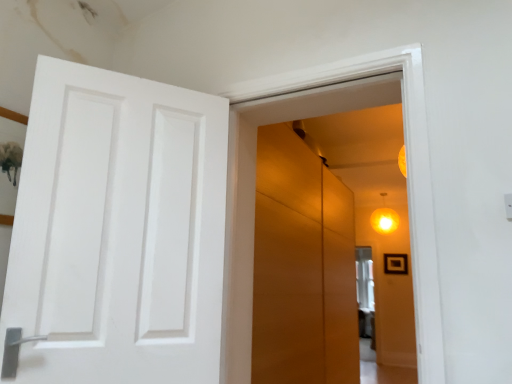
The image size is (512, 384). I want to click on black matte picture frame at upper right, so click(395, 264).

Locate an element on the screen. The image size is (512, 384). black matte picture frame at upper right is located at coordinates (395, 264).

From the image's perspective, between matte yellow globe light at upper right and black matte picture frame at upper right, which one is located above?

From the image's view, matte yellow globe light at upper right is above.

Does matte yellow globe light at upper right touch black matte picture frame at upper right?

No, matte yellow globe light at upper right is not next to black matte picture frame at upper right.

Is matte yellow globe light at upper right to the left of black matte picture frame at upper right from the viewer's perspective?

Yes.

Can you confirm if matte yellow globe light at upper right is taller than black matte picture frame at upper right?

Yes, matte yellow globe light at upper right is taller than black matte picture frame at upper right.

Does matte orange cabinet at center appear on the right side of matte yellow globe light at upper right?

In fact, matte orange cabinet at center is to the left of matte yellow globe light at upper right.

From the image's perspective, between matte orange cabinet at center and matte yellow globe light at upper right, which one is located above?

matte yellow globe light at upper right.

Is matte orange cabinet at center beside matte yellow globe light at upper right?

No.

Does matte orange cabinet at center have a greater width compared to matte yellow globe light at upper right?

In fact, matte orange cabinet at center might be narrower than matte yellow globe light at upper right.

Is matte orange cabinet at center next to black matte picture frame at upper right and touching it?

matte orange cabinet at center and black matte picture frame at upper right are clearly separated.

How many degrees apart are the facing directions of matte orange cabinet at center and black matte picture frame at upper right?

There is a 90-degree angle between the facing directions of matte orange cabinet at center and black matte picture frame at upper right.

Considering the relative positions of matte orange cabinet at center and black matte picture frame at upper right in the image provided, is matte orange cabinet at center in front of black matte picture frame at upper right?

Yes, matte orange cabinet at center is in front of black matte picture frame at upper right.

From a real-world perspective, which is physically above, matte orange cabinet at center or black matte picture frame at upper right?

From a 3D spatial view, black matte picture frame at upper right is above.

Can you tell me how much black matte picture frame at upper right and matte yellow globe light at upper right differ in facing direction?

black matte picture frame at upper right and matte yellow globe light at upper right are facing 0.0057 degrees away from each other.

Which is closer to the camera, (391, 262) or (390, 229)?

Point (391, 262) is positioned farther from the camera compared to point (390, 229).

Considering the sizes of objects black matte picture frame at upper right and matte yellow globe light at upper right in the image provided, who is shorter, black matte picture frame at upper right or matte yellow globe light at upper right?

With less height is black matte picture frame at upper right.

Could you measure the distance between black matte picture frame at upper right and matte yellow globe light at upper right?

black matte picture frame at upper right and matte yellow globe light at upper right are 54.78 centimeters apart from each other.

Is black matte picture frame at upper right positioned in front of matte orange cabinet at center?

No, black matte picture frame at upper right is behind matte orange cabinet at center.

Does black matte picture frame at upper right turn towards matte orange cabinet at center?

Yes, black matte picture frame at upper right faces towards matte orange cabinet at center.

Which object is positioned more to the left, black matte picture frame at upper right or matte orange cabinet at center?

From the viewer's perspective, matte orange cabinet at center appears more on the left side.

From the image's perspective, is black matte picture frame at upper right above or below matte orange cabinet at center?

Clearly, from the image's perspective, black matte picture frame at upper right is below matte orange cabinet at center.

Find the location of `lighting above the matte orange cabinet at center (from the image's perspective)`. lighting above the matte orange cabinet at center (from the image's perspective) is located at coordinates (384, 220).

Is matte yellow globe light at upper right shorter than matte orange cabinet at center?

Correct, matte yellow globe light at upper right is not as tall as matte orange cabinet at center.

Does point (381, 215) lie in front of point (273, 181)?

No.

I want to click on lighting located above the black matte picture frame at upper right (from the image's perspective), so click(x=384, y=220).

The image size is (512, 384). I want to click on lighting above the matte orange cabinet at center (from a real-world perspective), so click(384, 220).

Based on their spatial positions, is matte orange cabinet at center or matte yellow globe light at upper right further from black matte picture frame at upper right?

matte orange cabinet at center.

Looking at the image, which one is located closer to matte orange cabinet at center, black matte picture frame at upper right or matte yellow globe light at upper right?

matte yellow globe light at upper right is positioned closer to the anchor matte orange cabinet at center.

Which object lies nearer to the anchor point matte yellow globe light at upper right, matte orange cabinet at center or black matte picture frame at upper right?

black matte picture frame at upper right is positioned closer to the anchor matte yellow globe light at upper right.

Looking at the image, which one is located closer to matte orange cabinet at center, matte yellow globe light at upper right or black matte picture frame at upper right?

The object closer to matte orange cabinet at center is matte yellow globe light at upper right.

Looking at the image, which one is located closer to black matte picture frame at upper right, matte yellow globe light at upper right or matte orange cabinet at center?

Among the two, matte yellow globe light at upper right is located nearer to black matte picture frame at upper right.

Which object lies further to the anchor point matte yellow globe light at upper right, black matte picture frame at upper right or matte orange cabinet at center?

matte orange cabinet at center is further to matte yellow globe light at upper right.

Identify the location of lighting positioned between matte orange cabinet at center and black matte picture frame at upper right from near to far. Image resolution: width=512 pixels, height=384 pixels. (384, 220).